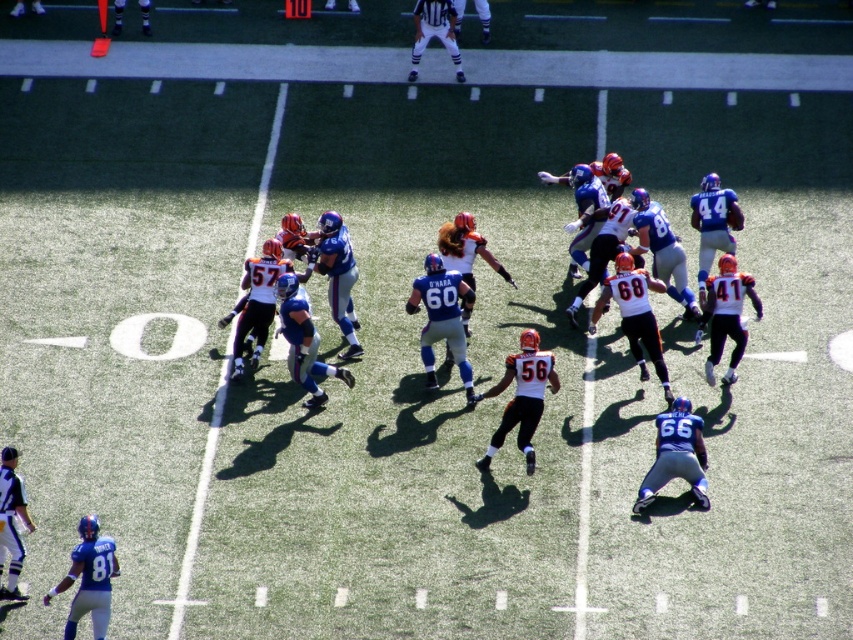
Is blue matte jersey at center in front of blue uniformed player at lower left?

No, blue matte jersey at center is further to the viewer.

Does blue matte jersey at center come behind blue uniformed player at lower left?

Yes, blue matte jersey at center is behind blue uniformed player at lower left.

Who is more forward, (430,321) or (9,499)?

Point (9,499) is in front.

Where is `blue matte jersey at center`? Image resolution: width=853 pixels, height=640 pixels. blue matte jersey at center is located at coordinates (440, 317).

Can you confirm if blue matte jersey at center is smaller than orange jersey at right?

No, blue matte jersey at center is not smaller than orange jersey at right.

At what (x,y) coordinates should I click in order to perform the action: click on blue matte jersey at center. Please return your answer as a coordinate pair (x, y). This screenshot has width=853, height=640. Looking at the image, I should click on (440, 317).

The image size is (853, 640). Find the location of `blue matte jersey at center`. blue matte jersey at center is located at coordinates (440, 317).

Which is behind, point (695, 428) or point (94, 564)?

The point (695, 428) is behind.

Is point (691, 438) positioned after point (109, 547)?

Yes, it is.

Locate an element on the screen. blue matte jersey at lower right is located at coordinates tap(676, 456).